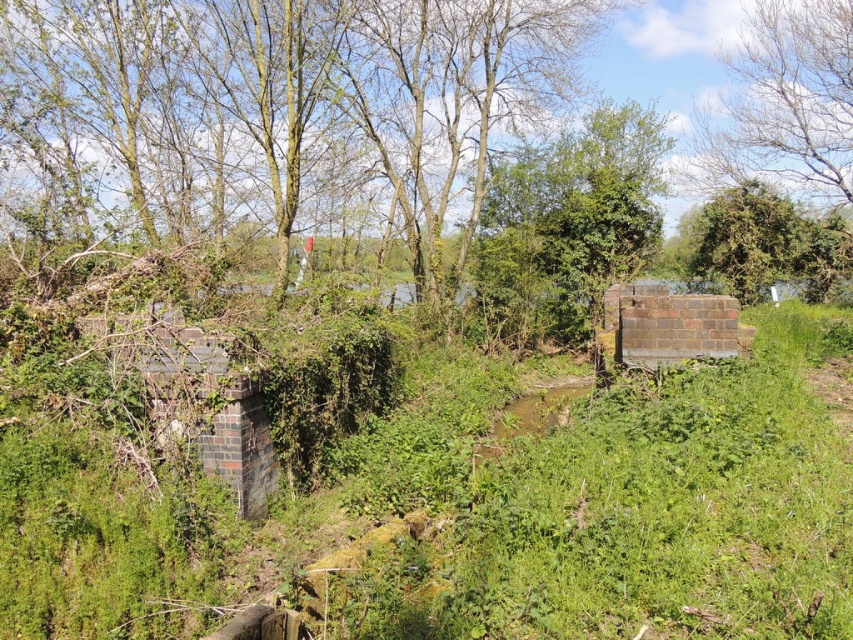
Question: Which point appears farthest from the camera in this image?

Choices:
 (A) (543, 320)
 (B) (347, 497)

Answer: (A)

Question: Is green leafy grass at center further to the viewer compared to green leafy tree at center?

Choices:
 (A) no
 (B) yes

Answer: (A)

Question: Which point appears closest to the camera in this image?

Choices:
 (A) (577, 259)
 (B) (711, 582)

Answer: (B)

Question: From the image, what is the correct spatial relationship of green leafy grass at center in relation to green leafy tree at center?

Choices:
 (A) right
 (B) left

Answer: (B)

Question: Which object is closer to the camera taking this photo?

Choices:
 (A) green leafy grass at center
 (B) green leafy tree at center

Answer: (A)

Question: Does green leafy grass at center have a smaller size compared to green leafy tree at center?

Choices:
 (A) no
 (B) yes

Answer: (A)